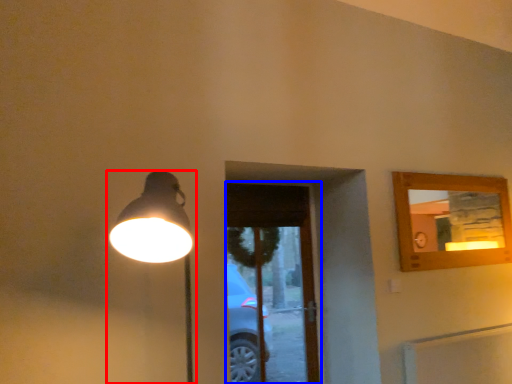
Question: Which object appears farthest to the camera in this image, lamp (highlighted by a red box) or screen door (highlighted by a blue box)?

Choices:
 (A) lamp
 (B) screen door

Answer: (B)